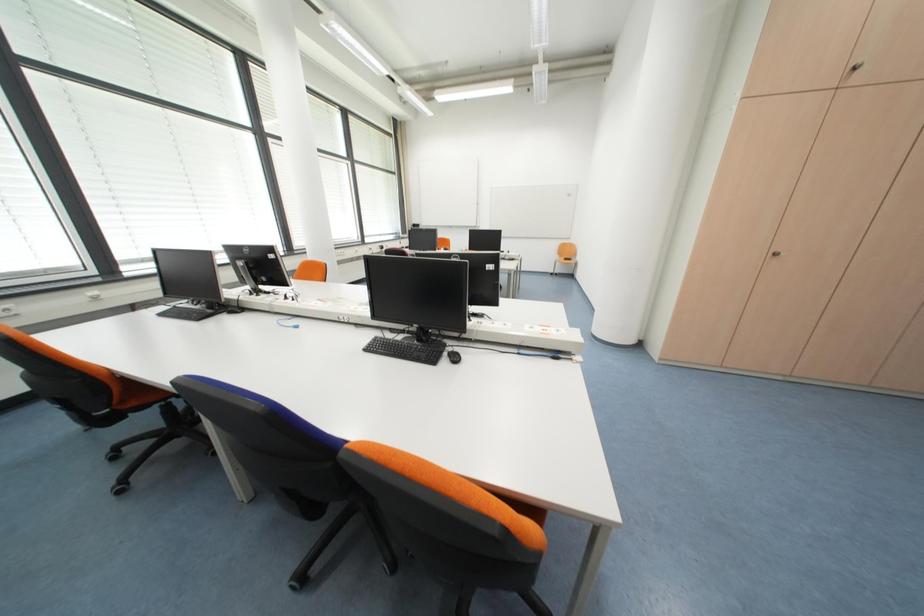
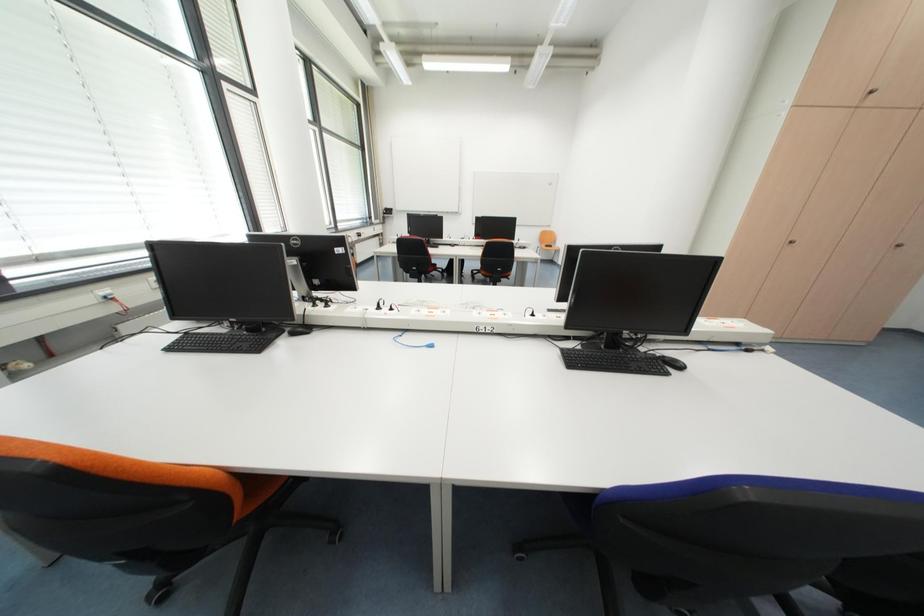
Question: Which direction would the cameraman need to move to produce the second image? Reply with the corresponding letter.

Choices:
 (A) Left
 (B) Right
 (C) Forward
 (D) Backward

Answer: (A)